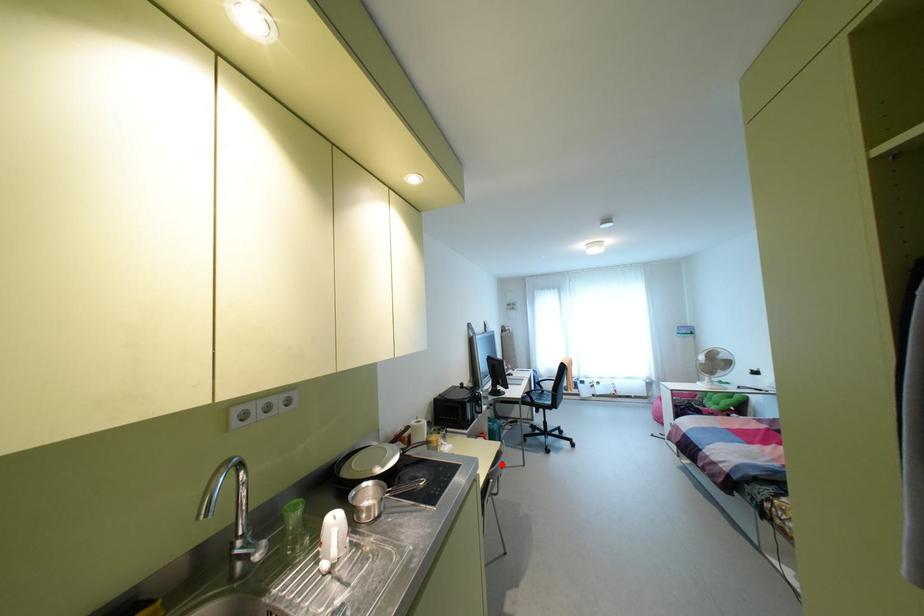
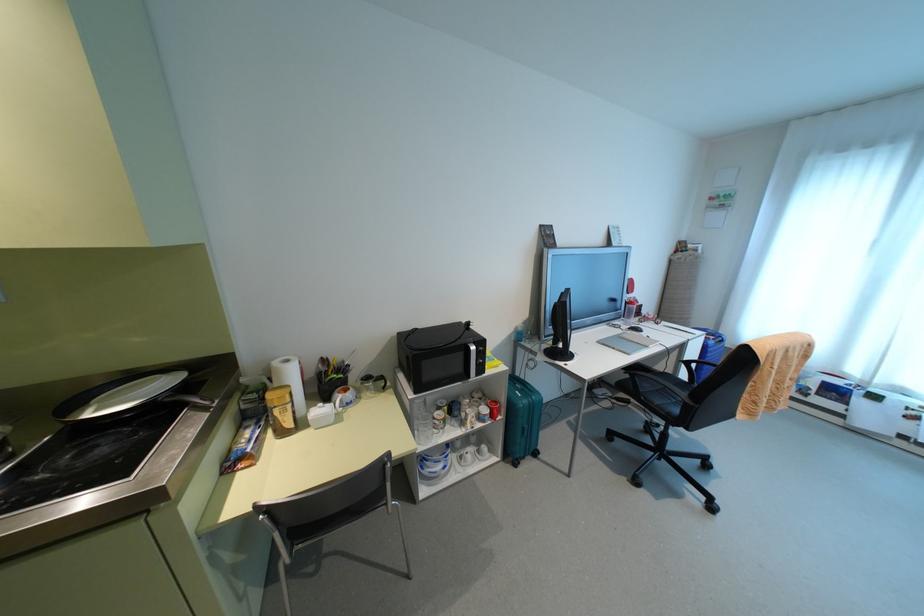
Question: I am providing you with two images of the same scene from different viewpoints. In image1, a red point is highlighted. Considering the same 3D point in image2, which of the following is correct?

Choices:
 (A) It is closer
 (B) It is farther

Answer: (A)